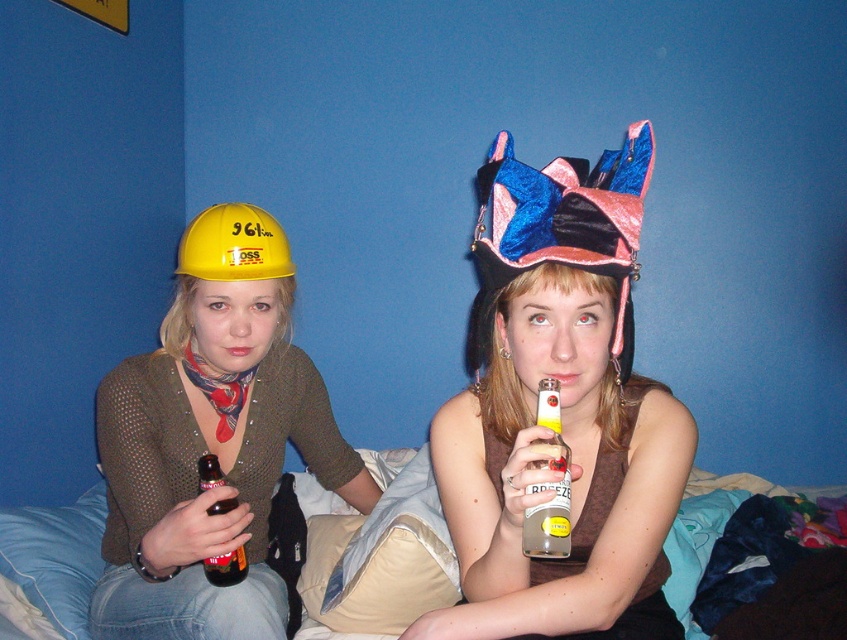
Between shiny blue fabric hat at center and clear glass bottle at center, which one appears on the left side from the viewer's perspective?

clear glass bottle at center is more to the left.

Is shiny blue fabric hat at center shorter than clear glass bottle at center?

No, shiny blue fabric hat at center is not shorter than clear glass bottle at center.

The width and height of the screenshot is (847, 640). Identify the location of shiny blue fabric hat at center. (560, 410).

Does point (562, 202) lie behind point (244, 572)?

No, (562, 202) is closer to viewer.

This screenshot has width=847, height=640. Describe the element at coordinates (558, 228) in the screenshot. I see `velvet pink and blue hat at center` at that location.

Find the location of `velvet pink and blue hat at center`. velvet pink and blue hat at center is located at coordinates (558, 228).

Can you confirm if shiny blue fabric hat at center is thinner than brown glass bottle at center?

Incorrect, shiny blue fabric hat at center's width is not less than brown glass bottle at center's.

Does shiny blue fabric hat at center have a larger size compared to brown glass bottle at center?

Correct, shiny blue fabric hat at center is larger in size than brown glass bottle at center.

Is point (605, 240) closer to camera compared to point (209, 474)?

Yes, it is.

Find the location of a particular element. shiny blue fabric hat at center is located at coordinates (560, 410).